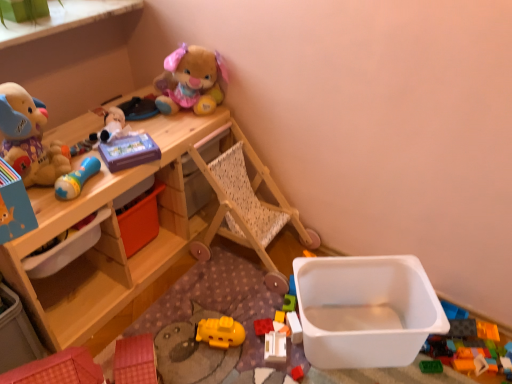
How much space does white plastic container at lower right, the 1th storage box ordered from the bottom, occupy vertically?

white plastic container at lower right, the 1th storage box ordered from the bottom, is 9.50 inches tall.

In order to click on wooden baby carriage at center in this screenshot , I will do `click(248, 203)`.

Measure the distance between translucent plastic blocks at center, the 3th toy when ordered from bottom to top, and camera.

They are 4.23 feet apart.

The width and height of the screenshot is (512, 384). What are the coordinates of `purple matte tissue box at upper center, which is the third toy from top to bottom` in the screenshot? It's located at (129, 152).

Find the location of a particular element. The width and height of the screenshot is (512, 384). white plastic container at lower right, the first storage box positioned from the right is located at coordinates (365, 310).

Can you confirm if white plastic storage box at left, arranged as the first storage box when viewed from the top, is smaller than wooden baby carriage at center?

Indeed, white plastic storage box at left, arranged as the first storage box when viewed from the top, has a smaller size compared to wooden baby carriage at center.

Is white plastic storage box at left, marked as the 2th storage box in a right-to-left arrangement, aimed at wooden baby carriage at center?

No.

Is wooden baby carriage at center located within white plastic storage box at left, marked as the 2th storage box in a right-to-left arrangement?

Actually, wooden baby carriage at center is outside white plastic storage box at left, marked as the 2th storage box in a right-to-left arrangement.

Could you measure the distance between fluffy plush rabbit at upper center, the 1th toy viewed from the top, and translucent plastic blocks at center, which ranks as the seventh toy in top-to-bottom order?

They are 90.62 centimeters apart.

Does point (183, 107) appear closer or farther from the camera than point (287, 320)?

Point (183, 107).

Looking at this image, considering the positions of objects fluffy plush rabbit at upper center, the 1th toy viewed from the top, and translucent plastic blocks at center, which ranks as the seventh toy in top-to-bottom order, in the image provided, who is more to the right, fluffy plush rabbit at upper center, the 1th toy viewed from the top, or translucent plastic blocks at center, which ranks as the seventh toy in top-to-bottom order,?

From the viewer's perspective, translucent plastic blocks at center, which ranks as the seventh toy in top-to-bottom order, appears more on the right side.

Does fluffy plush rabbit at upper center, which ranks as the 9th toy in bottom-to-top order, have a greater height compared to translucent plastic blocks at center, which ranks as the seventh toy in top-to-bottom order?

Correct, fluffy plush rabbit at upper center, which ranks as the 9th toy in bottom-to-top order, is much taller as translucent plastic blocks at center, which ranks as the seventh toy in top-to-bottom order.

Considering the relative positions of white plastic storage box at left, the second storage box ordered from the bottom, and yellow plastic submarine at center, the sixth toy when ordered from top to bottom, in the image provided, is white plastic storage box at left, the second storage box ordered from the bottom, to the left of yellow plastic submarine at center, the sixth toy when ordered from top to bottom, from the viewer's perspective?

Yes.

Considering the sizes of objects white plastic storage box at left, arranged as the first storage box when viewed from the top, and yellow plastic submarine at center, which ranks as the fourth toy in bottom-to-top order, in the image provided, who is thinner, white plastic storage box at left, arranged as the first storage box when viewed from the top, or yellow plastic submarine at center, which ranks as the fourth toy in bottom-to-top order,?

yellow plastic submarine at center, which ranks as the fourth toy in bottom-to-top order, is thinner.

From the image's perspective, is white plastic storage box at left, placed as the 1th storage box when sorted from left to right, located beneath yellow plastic submarine at center, which ranks as the fourth toy in bottom-to-top order?

Incorrect, from the image's perspective, white plastic storage box at left, placed as the 1th storage box when sorted from left to right, is higher than yellow plastic submarine at center, which ranks as the fourth toy in bottom-to-top order.

Measure the distance from white plastic storage box at left, placed as the 1th storage box when sorted from left to right, to yellow plastic submarine at center, the sixth toy when ordered from top to bottom.

19.41 inches.

From the white plastic toy at center, the 1th toy from the bottom, count the 6th toy to the left and point to it. Please provide its 2D coordinates.

[(29, 138)]

Who is bigger, white plastic toy at center, the 1th toy from the bottom, or soft plush toy at left, placed as the eighth toy when sorted from bottom to top?

soft plush toy at left, placed as the eighth toy when sorted from bottom to top, is bigger.

Looking at this image, from the image's perspective, which one is positioned lower, white plastic toy at center, which is the ninth toy in top-to-bottom order, or soft plush toy at left, which appears as the second toy when viewed from the top?

white plastic toy at center, which is the ninth toy in top-to-bottom order, from the image's perspective.

Measure the distance from white plastic toy at center, the 1th toy from the bottom, to soft plush toy at left, placed as the eighth toy when sorted from bottom to top.

They are 37.02 inches apart.

Does blue rubber rattle at upper left, the sixth toy ordered from the bottom, appear on the left side of purple matte tissue box at upper center, marked as the seventh toy in a bottom-to-top arrangement?

Indeed, blue rubber rattle at upper left, the sixth toy ordered from the bottom, is positioned on the left side of purple matte tissue box at upper center, marked as the seventh toy in a bottom-to-top arrangement.

Between blue rubber rattle at upper left, the sixth toy ordered from the bottom, and purple matte tissue box at upper center, which is the third toy from top to bottom, which one has more height?

With more height is blue rubber rattle at upper left, the sixth toy ordered from the bottom.

How different are the orientations of blue rubber rattle at upper left, the sixth toy ordered from the bottom, and purple matte tissue box at upper center, marked as the seventh toy in a bottom-to-top arrangement, in degrees?

45.9 degrees.

Considering the relative sizes of blue rubber rattle at upper left, the sixth toy ordered from the bottom, and purple matte tissue box at upper center, which is the third toy from top to bottom, in the image provided, is blue rubber rattle at upper left, the sixth toy ordered from the bottom, bigger than purple matte tissue box at upper center, which is the third toy from top to bottom,?

Actually, blue rubber rattle at upper left, the sixth toy ordered from the bottom, might be smaller than purple matte tissue box at upper center, which is the third toy from top to bottom.

Is yellow plastic submarine at center, which ranks as the fourth toy in bottom-to-top order, inside white plastic container at lower right, the first storage box positioned from the right?

No, white plastic container at lower right, the first storage box positioned from the right, does not contain yellow plastic submarine at center, which ranks as the fourth toy in bottom-to-top order.

Does point (325, 300) come farther from viewer compared to point (227, 318)?

Yes, point (325, 300) is behind point (227, 318).

Which of these two, white plastic container at lower right, the first storage box positioned from the right, or yellow plastic submarine at center, the sixth toy when ordered from top to bottom, is bigger?

white plastic container at lower right, the first storage box positioned from the right.

From a real-world perspective, is purple matte tissue box at upper center, which is the third toy from top to bottom, on white plastic container at lower right, which is the 2th storage box from left to right?

Yes, from a real-world perspective, purple matte tissue box at upper center, which is the third toy from top to bottom, is above white plastic container at lower right, which is the 2th storage box from left to right.

There is a purple matte tissue box at upper center, which is the third toy from top to bottom. At what (x,y) coordinates should I click in order to perform the action: click on the 2nd storage box below it (from a real-world perspective). Please return your answer as a coordinate pair (x, y). Looking at the image, I should click on pos(365,310).

Is purple matte tissue box at upper center, which is the third toy from top to bottom, bigger than white plastic container at lower right, the 1th storage box ordered from the bottom?

Actually, purple matte tissue box at upper center, which is the third toy from top to bottom, might be smaller than white plastic container at lower right, the 1th storage box ordered from the bottom.

In terms of width, does purple matte tissue box at upper center, marked as the seventh toy in a bottom-to-top arrangement, look wider or thinner when compared to white plastic container at lower right, which is the 2th storage box from left to right?

Considering their sizes, purple matte tissue box at upper center, marked as the seventh toy in a bottom-to-top arrangement, looks slimmer than white plastic container at lower right, which is the 2th storage box from left to right.

Where is `baby carriage on the right of white plastic storage box at left, arranged as the first storage box when viewed from the top`? baby carriage on the right of white plastic storage box at left, arranged as the first storage box when viewed from the top is located at coordinates (248, 203).

Where is `the 6th toy above when counting from the translucent plastic blocks at center, the 3th toy when ordered from bottom to top (from the image's perspective)`? The image size is (512, 384). the 6th toy above when counting from the translucent plastic blocks at center, the 3th toy when ordered from bottom to top (from the image's perspective) is located at coordinates (190, 81).

Estimate the real-world distances between objects in this image. Which object is further from wooden table at upper left, fluffy plush rabbit at upper center, which ranks as the 9th toy in bottom-to-top order, or purple matte tissue box at upper center, which is the third toy from top to bottom?

fluffy plush rabbit at upper center, which ranks as the 9th toy in bottom-to-top order, lies further to wooden table at upper left than the other object.

Based on their spatial positions, is purple matte tissue box at upper center, which is the third toy from top to bottom, or fluffy plush rabbit at upper center, the 1th toy viewed from the top, closer to soft plush toy at left, which appears as the second toy when viewed from the top?

Based on the image, purple matte tissue box at upper center, which is the third toy from top to bottom, appears to be nearer to soft plush toy at left, which appears as the second toy when viewed from the top.

From the image, which object appears to be farther from soft plush toy at left, placed as the eighth toy when sorted from bottom to top, blue rubber rattle at upper left, the fourth toy positioned from the top, or fluffy plush rabbit at upper center, the 1th toy viewed from the top?

fluffy plush rabbit at upper center, the 1th toy viewed from the top, is further to soft plush toy at left, placed as the eighth toy when sorted from bottom to top.

Based on their spatial positions, is white plastic storage box at left, placed as the 1th storage box when sorted from left to right, or rubberized red block at center, the eighth toy in the top-to-bottom sequence, closer to yellow plastic toy at center, the 5th toy positioned from the bottom?

rubberized red block at center, the eighth toy in the top-to-bottom sequence, lies closer to yellow plastic toy at center, the 5th toy positioned from the bottom, than the other object.

Which object lies further to the anchor point fluffy plush rabbit at upper center, which ranks as the 9th toy in bottom-to-top order, wooden baby carriage at center or blue rubber rattle at upper left, the sixth toy ordered from the bottom?

Based on the image, blue rubber rattle at upper left, the sixth toy ordered from the bottom, appears to be further to fluffy plush rabbit at upper center, which ranks as the 9th toy in bottom-to-top order.

Which object lies further to the anchor point yellow plastic toy at center, the 5th toy positioned from the bottom, purple matte tissue box at upper center, which is the third toy from top to bottom, or wooden baby carriage at center?

Based on the image, purple matte tissue box at upper center, which is the third toy from top to bottom, appears to be further to yellow plastic toy at center, the 5th toy positioned from the bottom.

Looking at the image, which one is located further to wooden baby carriage at center, rubberized red block at center, the second toy from the bottom, or blue rubber rattle at upper left, the sixth toy ordered from the bottom?

Among the two, blue rubber rattle at upper left, the sixth toy ordered from the bottom, is located further to wooden baby carriage at center.

Estimate the real-world distances between objects in this image. Which object is closer to yellow plastic submarine at center, which ranks as the fourth toy in bottom-to-top order, wooden table at upper left or purple matte tissue box at upper center, which is the third toy from top to bottom?

Based on the image, wooden table at upper left appears to be nearer to yellow plastic submarine at center, which ranks as the fourth toy in bottom-to-top order.

Find the location of `baby carriage that lies between fluffy plush rabbit at upper center, the 1th toy viewed from the top, and rubberized red block at center, the second toy from the bottom, from top to bottom`. baby carriage that lies between fluffy plush rabbit at upper center, the 1th toy viewed from the top, and rubberized red block at center, the second toy from the bottom, from top to bottom is located at coordinates (248, 203).

I want to click on baby carriage between blue rubber rattle at upper left, the sixth toy ordered from the bottom, and white plastic container at lower right, which is the 2th storage box from left to right, in the horizontal direction, so click(x=248, y=203).

Where is `baby carriage between white plastic storage box at left, marked as the 2th storage box in a right-to-left arrangement, and yellow plastic toy at center, the 5th toy when ordered from top to bottom, in the horizontal direction`? baby carriage between white plastic storage box at left, marked as the 2th storage box in a right-to-left arrangement, and yellow plastic toy at center, the 5th toy when ordered from top to bottom, in the horizontal direction is located at coordinates (248, 203).

What are the coordinates of `baby carriage situated between soft plush toy at left, which appears as the second toy when viewed from the top, and yellow plastic toy at center, the 5th toy positioned from the bottom, from left to right` in the screenshot? It's located at (248, 203).